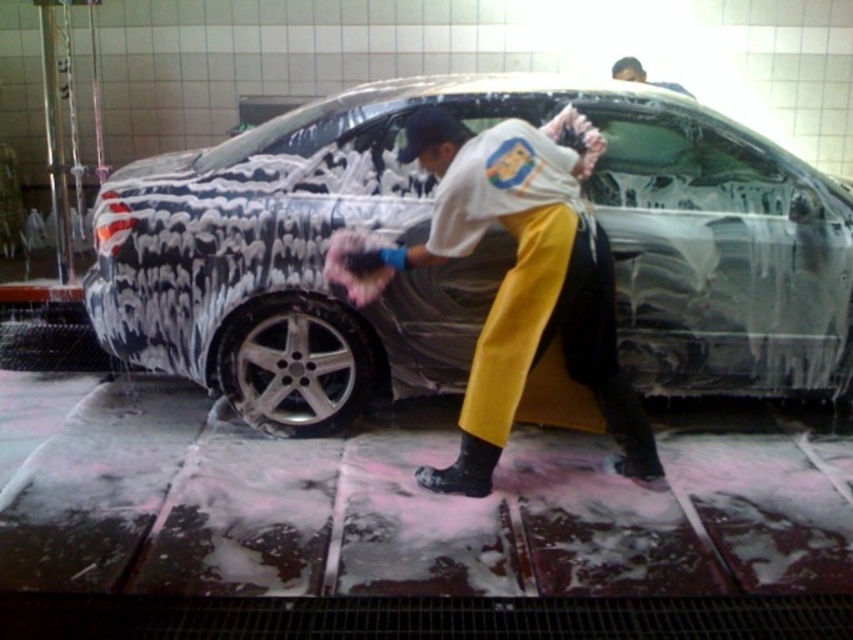
Question: Observing the image, what is the correct spatial positioning of spongy foam-covered car at center in reference to white cloth at center?

Choices:
 (A) below
 (B) above

Answer: (B)

Question: Which point is farther to the camera?

Choices:
 (A) (486, 376)
 (B) (135, 246)

Answer: (B)

Question: Where is spongy foam-covered car at center located in relation to white cloth at center in the image?

Choices:
 (A) left
 (B) right

Answer: (A)

Question: Which of the following is the closest to the observer?

Choices:
 (A) silver metallic tire at lower center
 (B) spongy foam-covered car at center
 (C) white cloth at center

Answer: (C)

Question: Which of these objects is positioned farthest from the white cloth at center?

Choices:
 (A) silver metallic tire at lower center
 (B) spongy foam-covered car at center

Answer: (A)

Question: Can you confirm if spongy foam-covered car at center is thinner than white cloth at center?

Choices:
 (A) no
 (B) yes

Answer: (A)